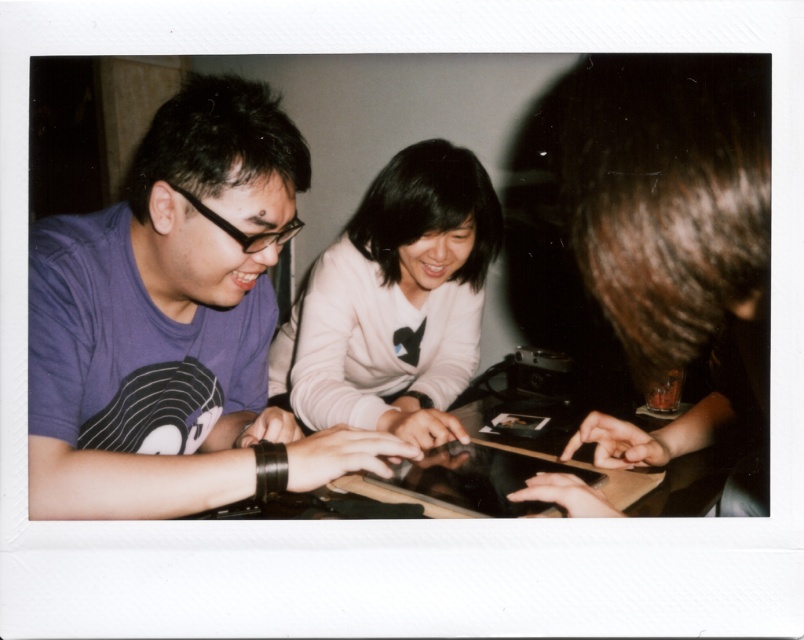
You are organizing a charity clothing drive and need to categorize the purple matte shirt at left and the white soft sweater at center based on their sizes. Which item is smaller?

The purple matte shirt at left is smaller compared to the white soft sweater at center.

What is the color of the shirt worn by the person at the position marked by the point coordinates (x=175, y=324)?

The point coordinates (x=175, y=324) correspond to the purple matte shirt at left, so the shirt is purple.